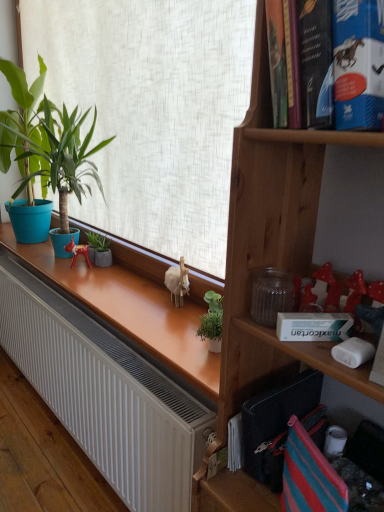
Question: Looking at the image, does metallic red figurine at center seem bigger or smaller compared to blue cardboard book at upper right?

Choices:
 (A) big
 (B) small

Answer: (B)

Question: Considering the positions of metallic red figurine at center and blue cardboard book at upper right in the image, is metallic red figurine at center wider or thinner than blue cardboard book at upper right?

Choices:
 (A) thin
 (B) wide

Answer: (A)

Question: Based on their relative distances, which object is farther from the metallic red figurine at center?

Choices:
 (A) green matte plant at left, the second houseplant viewed from the back
 (B) blue cardboard book at upper right
 (C) green matte planter at center, which is the 1th houseplant in bottom-to-top order
 (D) white matte radiator at lower left

Answer: (B)

Question: Which object is the closest to the white matte radiator at lower left?

Choices:
 (A) metallic red figurine at center
 (B) green matte planter at center, the 2th houseplant when ordered from top to bottom
 (C) green matte plant at left, the second houseplant viewed from the back
 (D) blue cardboard book at upper right

Answer: (B)